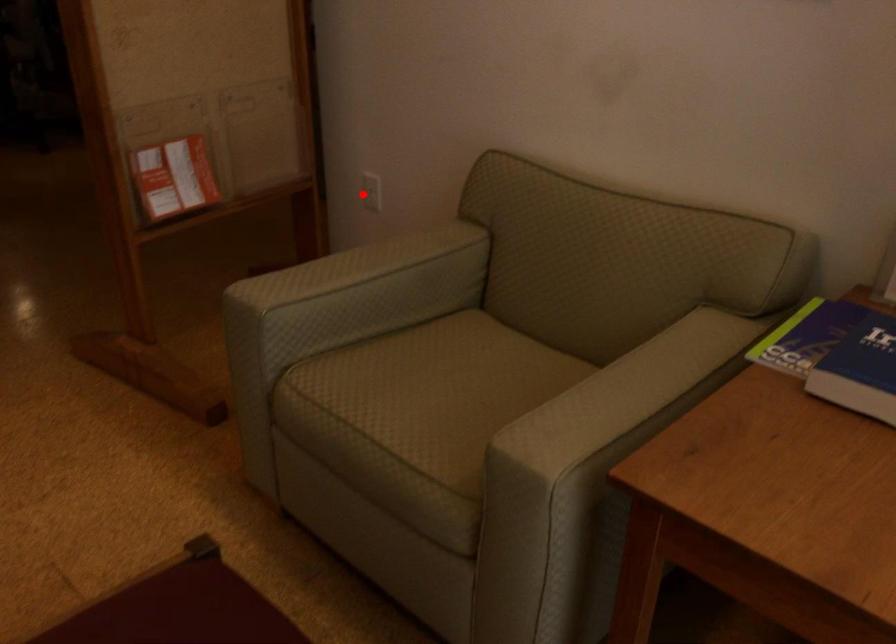
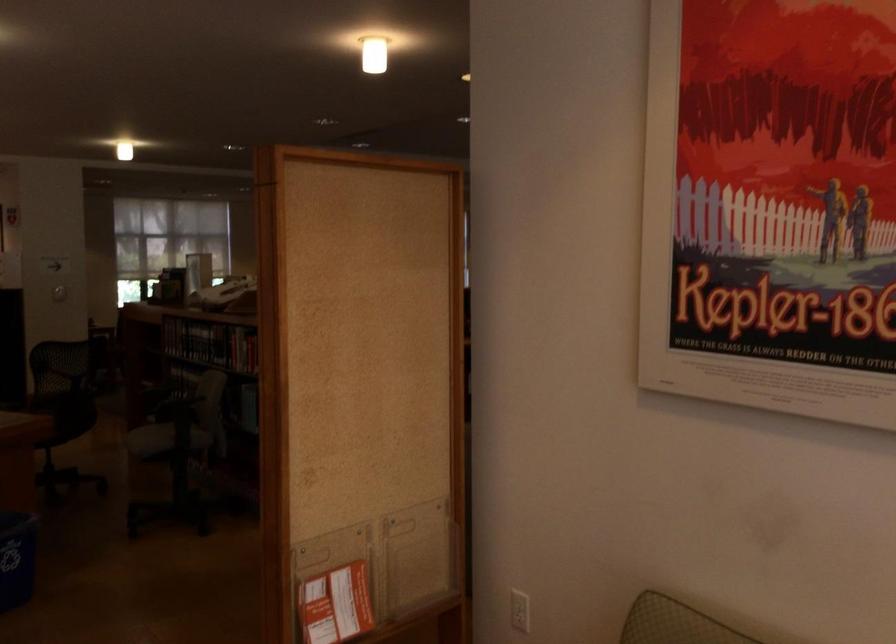
The point at the highlighted location is marked in the first image. Where is the corresponding point in the second image?

(520, 610)